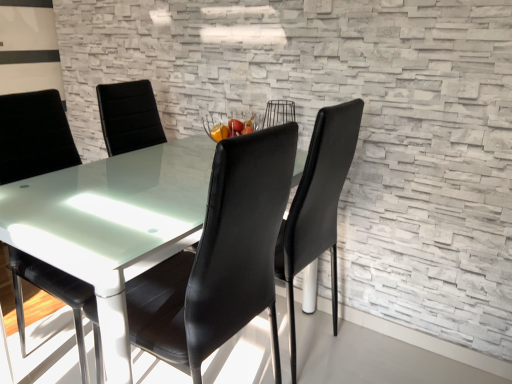
Measure the distance between black leather chair at left, the first chair in the left-to-right sequence, and camera.

A distance of 4.23 feet exists between black leather chair at left, the first chair in the left-to-right sequence, and camera.

At what (x,y) coordinates should I click in order to perform the action: click on black leather chair at left, the first chair in the left-to-right sequence. Please return your answer as a coordinate pair (x, y). Image resolution: width=512 pixels, height=384 pixels. Looking at the image, I should click on (34, 136).

What do you see at coordinates (34, 136) in the screenshot? This screenshot has height=384, width=512. I see `black leather chair at left, positioned as the second chair in right-to-left order` at bounding box center [34, 136].

What do you see at coordinates (248, 242) in the screenshot?
I see `black leather chair at center, which appears as the 1th chair when viewed from the right` at bounding box center [248, 242].

Find the location of `black leather chair at center, which appears as the 1th chair when viewed from the right`. black leather chair at center, which appears as the 1th chair when viewed from the right is located at coordinates 248,242.

You are a GUI agent. You are given a task and a screenshot of the screen. Output one action in this format:
    pyautogui.click(x=<x>, y=<y>)
    Task: Click on the black leather chair at left, the first chair in the left-to-right sequence
    
    Given the screenshot: What is the action you would take?
    pyautogui.click(x=34, y=136)

Which is more to the left, black leather chair at center, which appears as the 1th chair when viewed from the right, or black leather chair at left, positioned as the second chair in right-to-left order?

black leather chair at left, positioned as the second chair in right-to-left order.

Is black leather chair at center, the 2th chair when ordered from left to right, closer to camera compared to black leather chair at left, positioned as the second chair in right-to-left order?

Yes, it is.

Which is in front, point (244, 237) or point (16, 105)?

The point (244, 237) is in front.

From the image's perspective, is black leather chair at center, which appears as the 1th chair when viewed from the right, above black leather chair at left, positioned as the second chair in right-to-left order?

No.

From a real-world perspective, who is located higher, black leather chair at center, the 2th chair when ordered from left to right, or black leather chair at left, the first chair in the left-to-right sequence?

From a 3D spatial view, black leather chair at center, the 2th chair when ordered from left to right, is above.

Between black leather chair at center, the 2th chair when ordered from left to right, and black leather chair at left, positioned as the second chair in right-to-left order, which one has larger width?

With larger width is black leather chair at left, positioned as the second chair in right-to-left order.

Between black leather chair at center, the 2th chair when ordered from left to right, and black leather chair at left, the first chair in the left-to-right sequence, which one has less height?

black leather chair at left, the first chair in the left-to-right sequence.

In the scene shown: Is black leather chair at center, which appears as the 1th chair when viewed from the right, bigger or smaller than black leather chair at left, the first chair in the left-to-right sequence?

In the image, black leather chair at center, which appears as the 1th chair when viewed from the right, appears to be smaller than black leather chair at left, the first chair in the left-to-right sequence.

Does black leather chair at center, the 2th chair when ordered from left to right, contain black leather chair at left, the first chair in the left-to-right sequence?

Actually, black leather chair at left, the first chair in the left-to-right sequence, is outside black leather chair at center, the 2th chair when ordered from left to right.

Can you see black leather chair at center, the 2th chair when ordered from left to right, touching black leather chair at left, the first chair in the left-to-right sequence?

No, black leather chair at center, the 2th chair when ordered from left to right, is not touching black leather chair at left, the first chair in the left-to-right sequence.

Could you tell me if black leather chair at center, which appears as the 1th chair when viewed from the right, is turned towards black leather chair at left, positioned as the second chair in right-to-left order?

Yes, black leather chair at center, which appears as the 1th chair when viewed from the right, is oriented towards black leather chair at left, positioned as the second chair in right-to-left order.

What's the angular difference between black leather chair at center, which appears as the 1th chair when viewed from the right, and black leather chair at left, positioned as the second chair in right-to-left order,'s facing directions?

black leather chair at center, which appears as the 1th chair when viewed from the right, and black leather chair at left, positioned as the second chair in right-to-left order, are facing 179 degrees away from each other.

Image resolution: width=512 pixels, height=384 pixels. I want to click on chair located behind the black leather chair at center, which appears as the 1th chair when viewed from the right, so click(x=34, y=136).

Based on their positions, is black leather chair at left, the first chair in the left-to-right sequence, located to the left or right of black leather chair at center, which appears as the 1th chair when viewed from the right?

black leather chair at left, the first chair in the left-to-right sequence, is to the left of black leather chair at center, which appears as the 1th chair when viewed from the right.

Which is in front, black leather chair at left, the first chair in the left-to-right sequence, or black leather chair at center, which appears as the 1th chair when viewed from the right?

black leather chair at center, which appears as the 1th chair when viewed from the right, is more forward.

Is point (47, 124) positioned before point (337, 326)?

That is True.

From the image's perspective, is black leather chair at left, positioned as the second chair in right-to-left order, positioned above or below black leather chair at center, the 2th chair when ordered from left to right?

Clearly, from the image's perspective, black leather chair at left, positioned as the second chair in right-to-left order, is above black leather chair at center, the 2th chair when ordered from left to right.

From a real-world perspective, between black leather chair at left, the first chair in the left-to-right sequence, and black leather chair at center, the 2th chair when ordered from left to right, who is vertically higher?

black leather chair at center, the 2th chair when ordered from left to right, from a real-world perspective.

In terms of width, does black leather chair at left, the first chair in the left-to-right sequence, look wider or thinner when compared to black leather chair at center, the 2th chair when ordered from left to right?

black leather chair at left, the first chair in the left-to-right sequence, is wider than black leather chair at center, the 2th chair when ordered from left to right.

Can you confirm if black leather chair at left, positioned as the second chair in right-to-left order, is shorter than black leather chair at center, the 2th chair when ordered from left to right?

Correct, black leather chair at left, positioned as the second chair in right-to-left order, is not as tall as black leather chair at center, the 2th chair when ordered from left to right.

From the picture: Who is smaller, black leather chair at left, the first chair in the left-to-right sequence, or black leather chair at center, which appears as the 1th chair when viewed from the right?

With smaller size is black leather chair at center, which appears as the 1th chair when viewed from the right.

Could black leather chair at center, which appears as the 1th chair when viewed from the right, be considered to be inside black leather chair at left, the first chair in the left-to-right sequence?

No, black leather chair at center, which appears as the 1th chair when viewed from the right, is not surrounded by black leather chair at left, the first chair in the left-to-right sequence.

Does black leather chair at left, positioned as the second chair in right-to-left order, turn towards black leather chair at center, the 2th chair when ordered from left to right?

Yes.

How different are the orientations of black leather chair at left, the first chair in the left-to-right sequence, and black leather chair at center, which appears as the 1th chair when viewed from the right, in degrees?

black leather chair at left, the first chair in the left-to-right sequence, and black leather chair at center, which appears as the 1th chair when viewed from the right, are facing 179 degrees away from each other.

Measure the distance from black leather chair at left, positioned as the second chair in right-to-left order, to black leather chair at center, the 2th chair when ordered from left to right.

black leather chair at left, positioned as the second chair in right-to-left order, and black leather chair at center, the 2th chair when ordered from left to right, are 24.73 inches apart.

Identify the location of chair in front of the black leather chair at left, the first chair in the left-to-right sequence. This screenshot has width=512, height=384. (248, 242).

You are a GUI agent. You are given a task and a screenshot of the screen. Output one action in this format:
    pyautogui.click(x=<x>, y=<y>)
    Task: Click on the chair above the black leather chair at left, positioned as the second chair in right-to-left order (from a real-world perspective)
    The image size is (512, 384).
    Given the screenshot: What is the action you would take?
    pyautogui.click(x=248, y=242)

The width and height of the screenshot is (512, 384). Find the location of `chair below the black leather chair at center, which appears as the 1th chair when viewed from the right (from a real-world perspective)`. chair below the black leather chair at center, which appears as the 1th chair when viewed from the right (from a real-world perspective) is located at coordinates (34, 136).